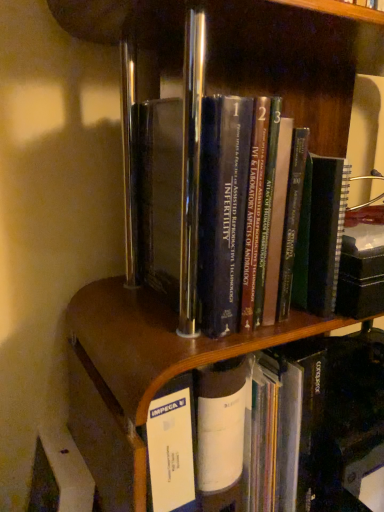
Question: Is hardcover books at center, placed as the 1th book when sorted from top to bottom, wider or thinner than hardcover book at center, acting as the first book starting from the bottom?

Choices:
 (A) thin
 (B) wide

Answer: (A)

Question: Would you say hardcover books at center, placed as the 1th book when sorted from top to bottom, is to the left or to the right of hardcover book at center, acting as the 2th book starting from the top, in the picture?

Choices:
 (A) left
 (B) right

Answer: (A)

Question: Would you say hardcover books at center, placed as the 1th book when sorted from top to bottom, is inside or outside hardcover book at center, acting as the 2th book starting from the top?

Choices:
 (A) inside
 (B) outside

Answer: (B)

Question: Is hardcover book at center, acting as the 2th book starting from the top, wider or thinner than hardcover books at center, placed as the 1th book when sorted from top to bottom?

Choices:
 (A) thin
 (B) wide

Answer: (B)

Question: Is hardcover book at center, acting as the 2th book starting from the top, to the left or to the right of hardcover books at center, the second book in the bottom-to-top sequence, in the image?

Choices:
 (A) left
 (B) right

Answer: (B)

Question: From their relative heights in the image, would you say hardcover book at center, acting as the 2th book starting from the top, is taller or shorter than hardcover books at center, placed as the 1th book when sorted from top to bottom?

Choices:
 (A) tall
 (B) short

Answer: (B)

Question: Is hardcover book at center, acting as the 2th book starting from the top, in front of or behind hardcover books at center, the second book in the bottom-to-top sequence, in the image?

Choices:
 (A) front
 (B) behind

Answer: (B)